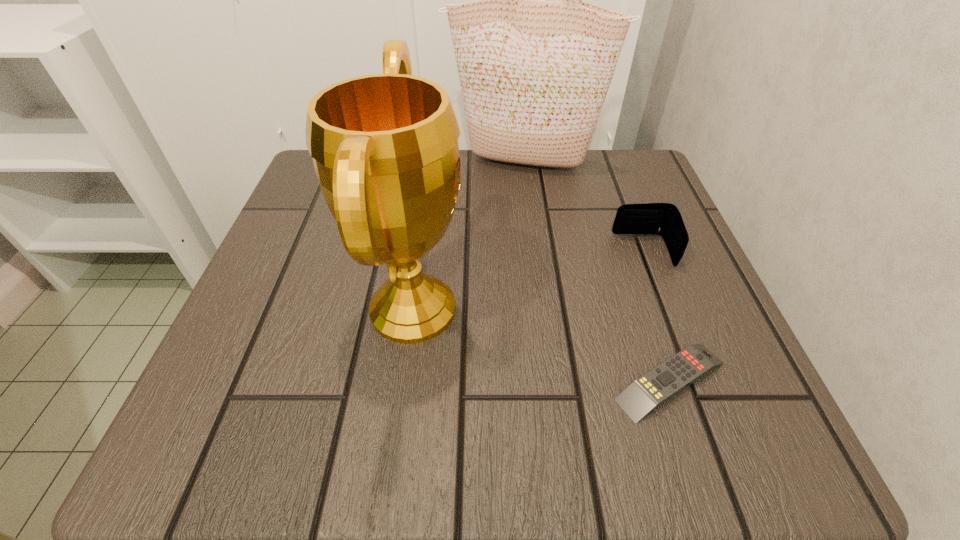
Image resolution: width=960 pixels, height=540 pixels. Identify the location of vacant space that is in between the shortest object and the award. (541, 345).

This screenshot has height=540, width=960. I want to click on vacant region between the shortest object and the third tallest object, so click(x=657, y=316).

At what (x,y) coordinates should I click in order to perform the action: click on unoccupied area between the award and the tallest object. Please return your answer as a coordinate pair (x, y). Looking at the image, I should click on (468, 235).

At what (x,y) coordinates should I click in order to perform the action: click on free space between the farthest object and the remote control. Please return your answer as a coordinate pair (x, y). Looking at the image, I should click on (597, 272).

The image size is (960, 540). Find the location of `free point between the award and the second shortest object`. free point between the award and the second shortest object is located at coordinates (528, 280).

Where is `empty space that is in between the wallet and the tallest object`? empty space that is in between the wallet and the tallest object is located at coordinates (584, 207).

The width and height of the screenshot is (960, 540). What are the coordinates of `object that is the second closest to the farthest object` in the screenshot? It's located at (385, 150).

Select which object is the closest to the second shortest object. Please provide its 2D coordinates. Your answer should be formatted as a tuple, i.e. [(x, y)], where the tuple contains the x and y coordinates of a point satisfying the conditions above.

[(645, 394)]

I want to click on free space that satisfies the following two spatial constraints: 1. on the front side of the shortest object; 2. on the left side of the farthest object, so click(x=551, y=381).

Where is `free space in the image that satisfies the following two spatial constraints: 1. on the outer surface of the wallet; 2. on the front side of the shortest object`? free space in the image that satisfies the following two spatial constraints: 1. on the outer surface of the wallet; 2. on the front side of the shortest object is located at coordinates (693, 381).